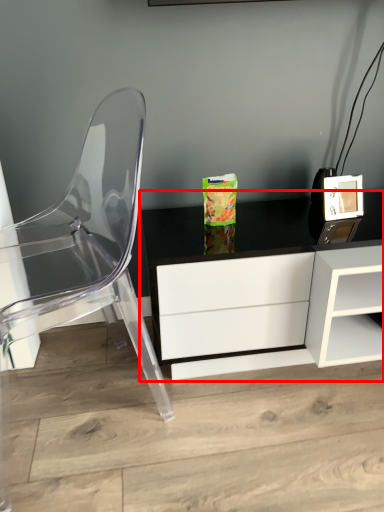
Question: From the image's perspective, where is table (annotated by the red box) located relative to chair?

Choices:
 (A) below
 (B) above

Answer: (A)